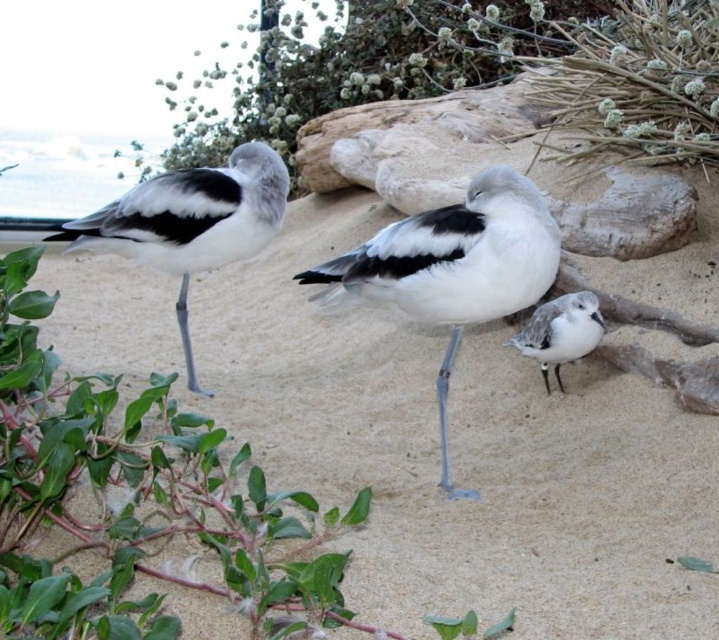
Question: Among these objects, which one is farthest from the camera?

Choices:
 (A) white matte/sand-colored bird at lower right
 (B) white matte bird at left
 (C) white matte bird at center
 (D) green leafy plant at upper center

Answer: (D)

Question: Is white matte bird at center below white matte bird at left?

Choices:
 (A) no
 (B) yes

Answer: (B)

Question: Which is nearer to the white matte bird at left?

Choices:
 (A) white matte/sand-colored bird at lower right
 (B) white matte bird at center

Answer: (B)

Question: Does white matte bird at center appear on the right side of white matte bird at left?

Choices:
 (A) no
 (B) yes

Answer: (B)

Question: Can you confirm if green leafy plant at upper center is thinner than white matte bird at center?

Choices:
 (A) no
 (B) yes

Answer: (A)

Question: Which point is closer to the camera taking this photo?

Choices:
 (A) (582, 355)
 (B) (187, 236)

Answer: (B)